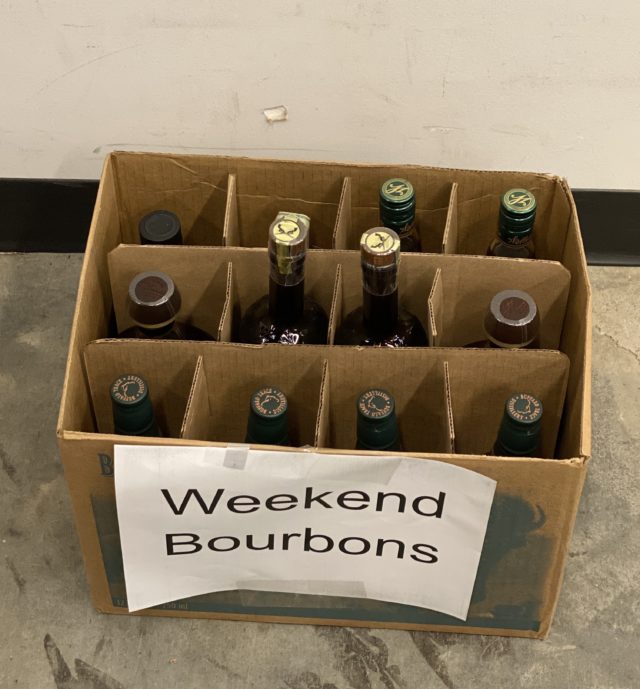
You are a GUI agent. You are given a task and a screenshot of the screen. Output one action in this format:
    pyautogui.click(x=<x>, y=<y>)
    Task: Click on the black baseboard
    This screenshot has width=640, height=689.
    Given the screenshot: What is the action you would take?
    pyautogui.click(x=586, y=227)